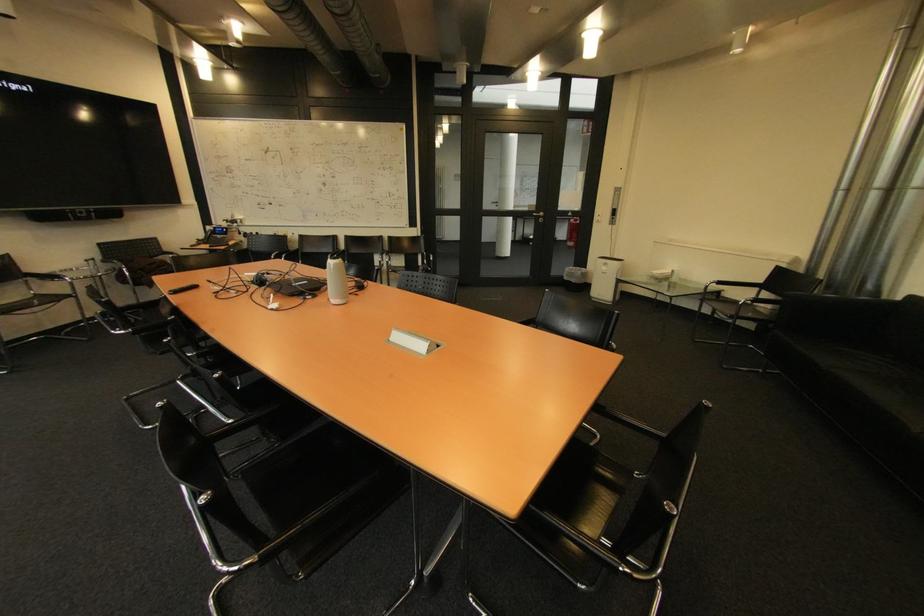
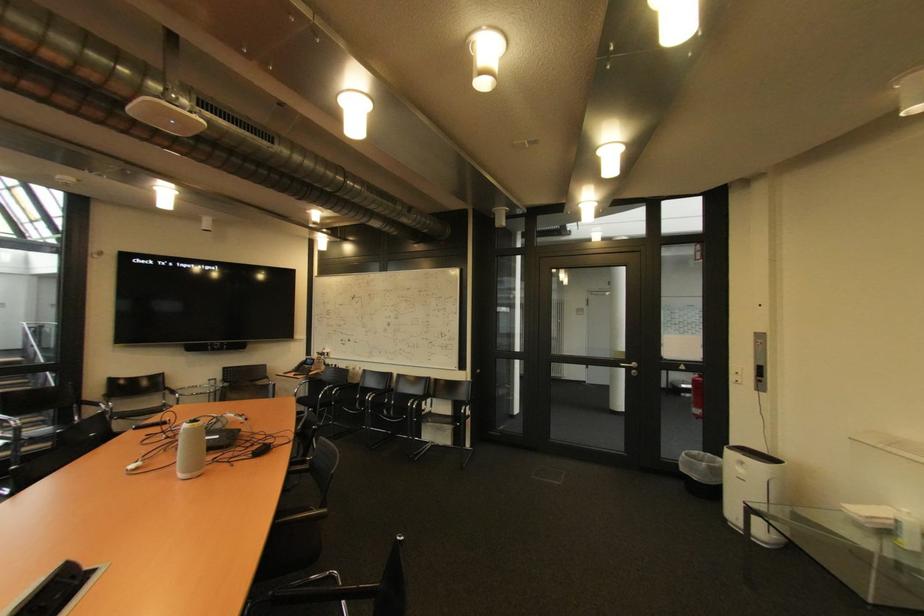
Where in the second image is the point corresponding to the point at 574,280 from the first image?

(690, 471)